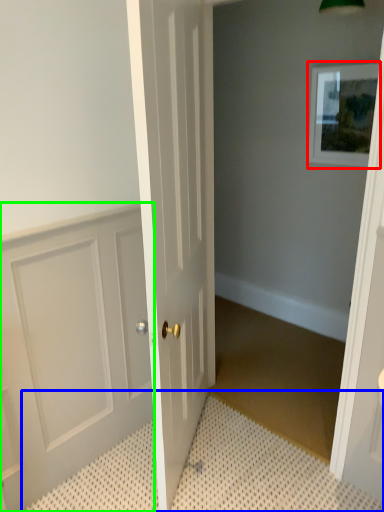
Question: Estimate the real-world distances between objects in this image. Which object is closer to picture frame (highlighted by a red box), bath mat (highlighted by a blue box) or door (highlighted by a green box)?

Choices:
 (A) bath mat
 (B) door

Answer: (B)